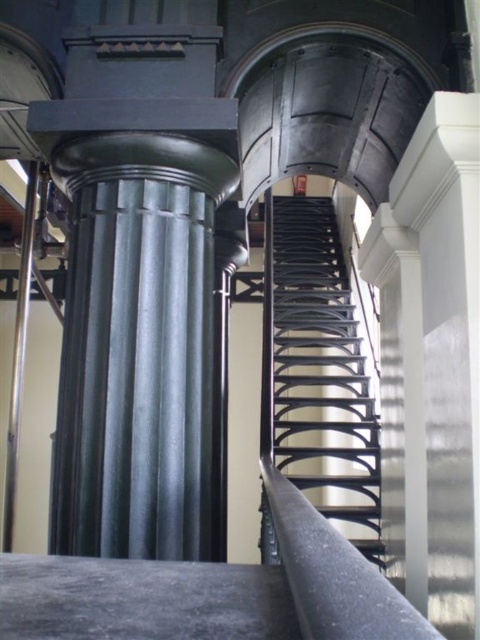
You are a maintenance worker needing to move a 1.2 meter wide equipment cart through the space between the black metal staircase at center and the silver metallic pole at left. Can the cart pass through?

The black metal staircase at center might be wider than silver metallic pole at left, so it is uncertain if the 1.2 meter wide equipment cart can pass through without checking the exact width difference between the two objects.

You are standing in the historic building and want to reach the next floor using the staircase. Which direction should you move relative to the silver metallic pole at left to approach the black metal staircase at center?

You should move to the right of the silver metallic pole at left to approach the black metal staircase at center, as it is located to the right of the pole.